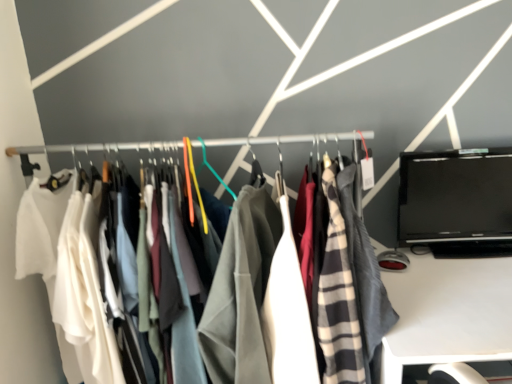
Question: Is the position of black glossy laptop at right less distant than that of white plastic desk at lower right?

Choices:
 (A) yes
 (B) no

Answer: (B)

Question: Does black glossy laptop at right have a greater height compared to white plastic desk at lower right?

Choices:
 (A) no
 (B) yes

Answer: (A)

Question: Can you confirm if black glossy laptop at right is smaller than white plastic desk at lower right?

Choices:
 (A) yes
 (B) no

Answer: (A)

Question: Does black glossy laptop at right have a lesser height compared to white plastic desk at lower right?

Choices:
 (A) yes
 (B) no

Answer: (A)

Question: Does black glossy laptop at right lie behind white plastic desk at lower right?

Choices:
 (A) no
 (B) yes

Answer: (B)

Question: In terms of height, does black glossy laptop at right look taller or shorter compared to matte fabric clothes at center?

Choices:
 (A) tall
 (B) short

Answer: (B)

Question: From the image's perspective, is black glossy laptop at right located above or below matte fabric clothes at center?

Choices:
 (A) below
 (B) above

Answer: (B)

Question: In terms of size, does black glossy laptop at right appear bigger or smaller than matte fabric clothes at center?

Choices:
 (A) big
 (B) small

Answer: (B)

Question: From a real-world perspective, is black glossy laptop at right above or below matte fabric clothes at center?

Choices:
 (A) below
 (B) above

Answer: (B)

Question: Is matte fabric clothes at center in front of or behind white plastic desk at lower right in the image?

Choices:
 (A) behind
 (B) front

Answer: (A)

Question: In the image, is matte fabric clothes at center on the left side or the right side of white plastic desk at lower right?

Choices:
 (A) right
 (B) left

Answer: (B)

Question: Is point (170, 147) positioned closer to the camera than point (498, 347)?

Choices:
 (A) farther
 (B) closer

Answer: (A)

Question: From a real-world perspective, relative to white plastic desk at lower right, is matte fabric clothes at center vertically above or below?

Choices:
 (A) below
 (B) above

Answer: (B)

Question: Considering their positions, is matte fabric clothes at center located in front of or behind black glossy laptop at right?

Choices:
 (A) behind
 (B) front

Answer: (B)

Question: From the image's perspective, relative to black glossy laptop at right, is matte fabric clothes at center above or below?

Choices:
 (A) below
 (B) above

Answer: (A)